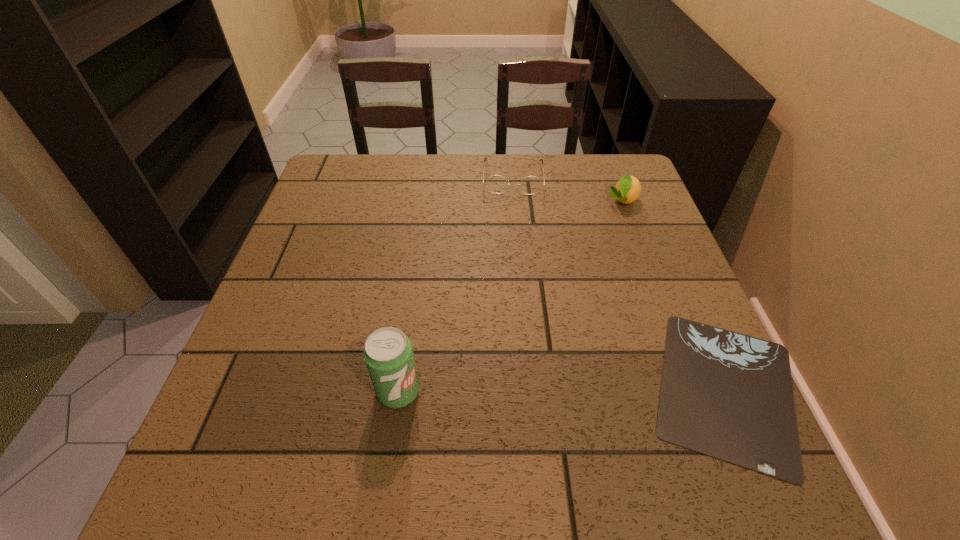
The width and height of the screenshot is (960, 540). Identify the location of vacant region located 0.080m with leaves positioned above the second tallest object. click(x=613, y=230).

Locate an element on the screen. The height and width of the screenshot is (540, 960). blank space located on the front-facing side of the spectacles is located at coordinates (513, 209).

The width and height of the screenshot is (960, 540). Identify the location of free spot located 0.210m on the front-facing side of the spectacles. (514, 247).

This screenshot has width=960, height=540. I want to click on free region located on the front-facing side of the spectacles, so click(x=514, y=287).

You are a GUI agent. You are given a task and a screenshot of the screen. Output one action in this format:
    pyautogui.click(x=<x>, y=<y>)
    Task: Click on the lemon at the far edge
    The image size is (960, 540).
    Given the screenshot: What is the action you would take?
    pyautogui.click(x=627, y=190)

What are the coordinates of `spectacles at the far edge` in the screenshot? It's located at (497, 184).

Where is `soda situated at the near edge`? soda situated at the near edge is located at coordinates (388, 354).

Locate an element on the screen. This screenshot has width=960, height=540. mousepad located in the near edge section of the desktop is located at coordinates (727, 395).

Find the location of a particular element. The height and width of the screenshot is (540, 960). mousepad present at the right edge is located at coordinates (727, 395).

Locate an element on the screen. The image size is (960, 540). lemon that is positioned at the right edge is located at coordinates (627, 190).